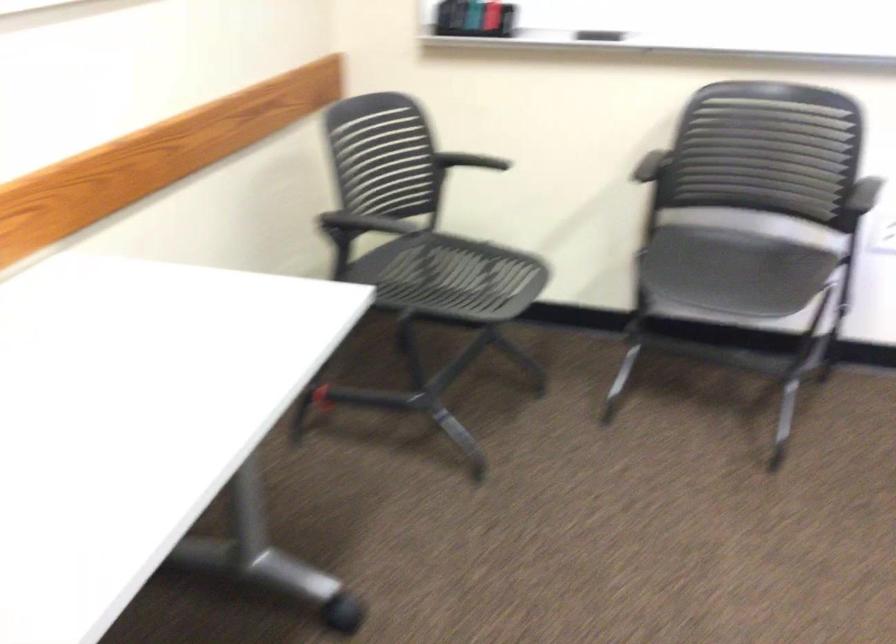
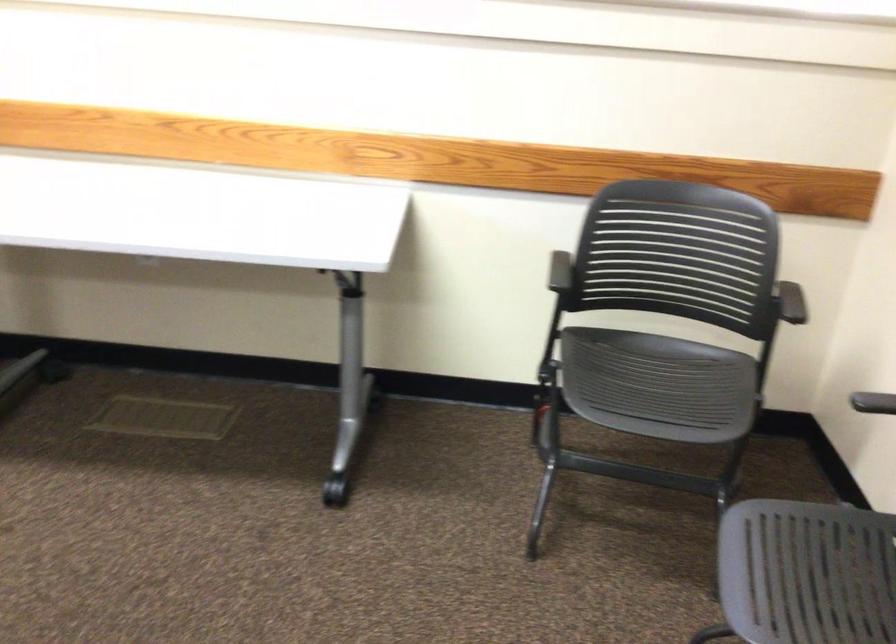
The point at (702, 281) is marked in the first image. Where is the corresponding point in the second image?

(806, 573)